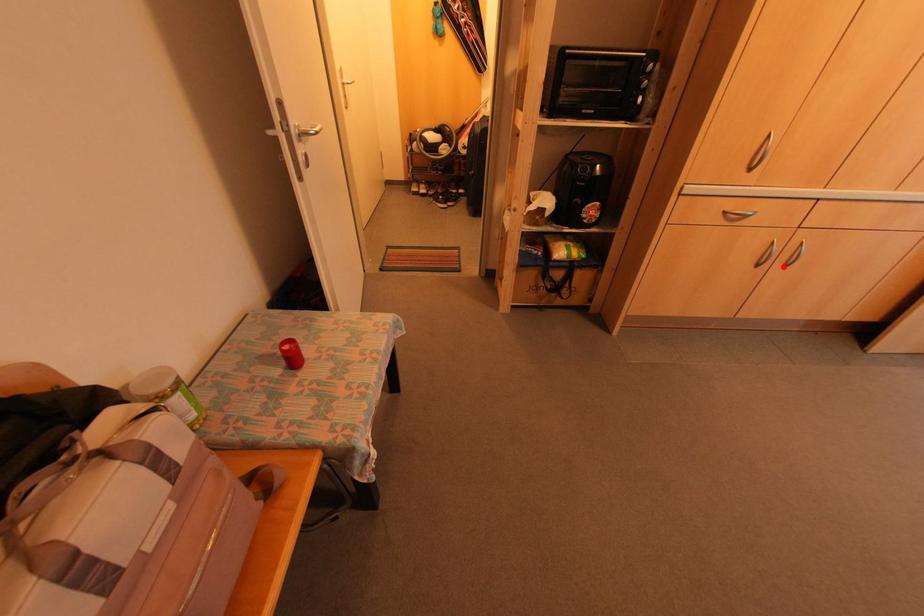
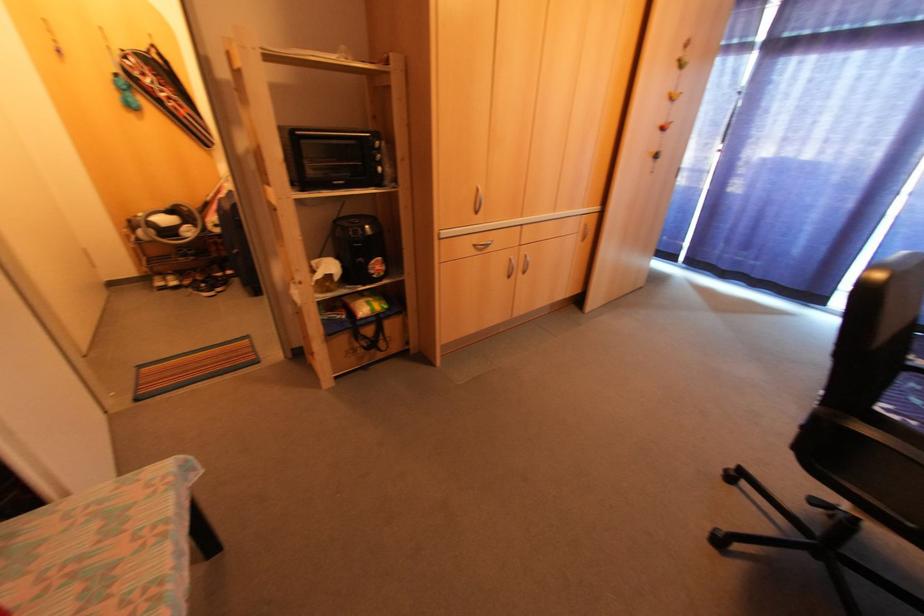
Find the pixel in the second image that matches the highlighted location in the first image.

(521, 273)